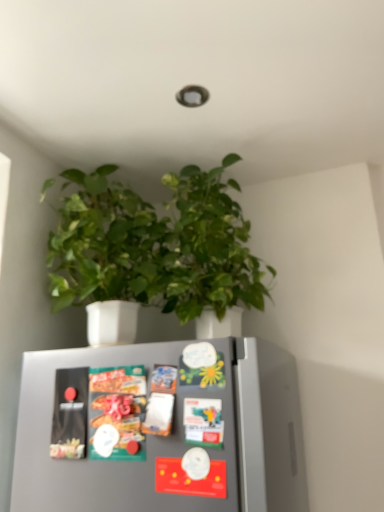
Question: Could green matte plant at upper center be considered to be inside matte plastic snack packet at center?

Choices:
 (A) yes
 (B) no

Answer: (B)

Question: Considering the relative sizes of matte plastic snack packet at center and green matte plant at upper center in the image provided, is matte plastic snack packet at center smaller than green matte plant at upper center?

Choices:
 (A) no
 (B) yes

Answer: (B)

Question: Can you confirm if matte plastic snack packet at center is bigger than green matte plant at upper center?

Choices:
 (A) no
 (B) yes

Answer: (A)

Question: Is matte plastic snack packet at center to the left of green matte plant at upper center from the viewer's perspective?

Choices:
 (A) yes
 (B) no

Answer: (A)

Question: Is matte plastic snack packet at center further to the viewer compared to green matte plant at upper center?

Choices:
 (A) no
 (B) yes

Answer: (A)

Question: From a real-world perspective, is green matte plant at upper center positioned above or below matte plastic snack packet at center?

Choices:
 (A) above
 (B) below

Answer: (A)

Question: Considering the positions of green matte plant at upper center and matte plastic snack packet at center in the image, is green matte plant at upper center taller or shorter than matte plastic snack packet at center?

Choices:
 (A) tall
 (B) short

Answer: (A)

Question: Is green matte plant at upper center inside or outside of matte plastic snack packet at center?

Choices:
 (A) outside
 (B) inside

Answer: (A)

Question: In terms of width, does green matte plant at upper center look wider or thinner when compared to matte plastic snack packet at center?

Choices:
 (A) wide
 (B) thin

Answer: (A)

Question: From a real-world perspective, relative to metallic silver fridge magnets at center, is matte plastic snack packet at center vertically above or below?

Choices:
 (A) above
 (B) below

Answer: (A)

Question: In terms of width, does matte plastic snack packet at center look wider or thinner when compared to metallic silver fridge magnets at center?

Choices:
 (A) thin
 (B) wide

Answer: (B)

Question: From the image's perspective, is matte plastic snack packet at center above or below metallic silver fridge magnets at center?

Choices:
 (A) above
 (B) below

Answer: (A)

Question: Based on their sizes in the image, would you say matte plastic snack packet at center is bigger or smaller than metallic silver fridge magnets at center?

Choices:
 (A) small
 (B) big

Answer: (A)

Question: From a real-world perspective, is matte plastic snack packet at center positioned above or below green matte plant at upper center?

Choices:
 (A) above
 (B) below

Answer: (B)

Question: Considering the positions of point (130, 416) and point (210, 251), is point (130, 416) closer or farther from the camera than point (210, 251)?

Choices:
 (A) farther
 (B) closer

Answer: (B)